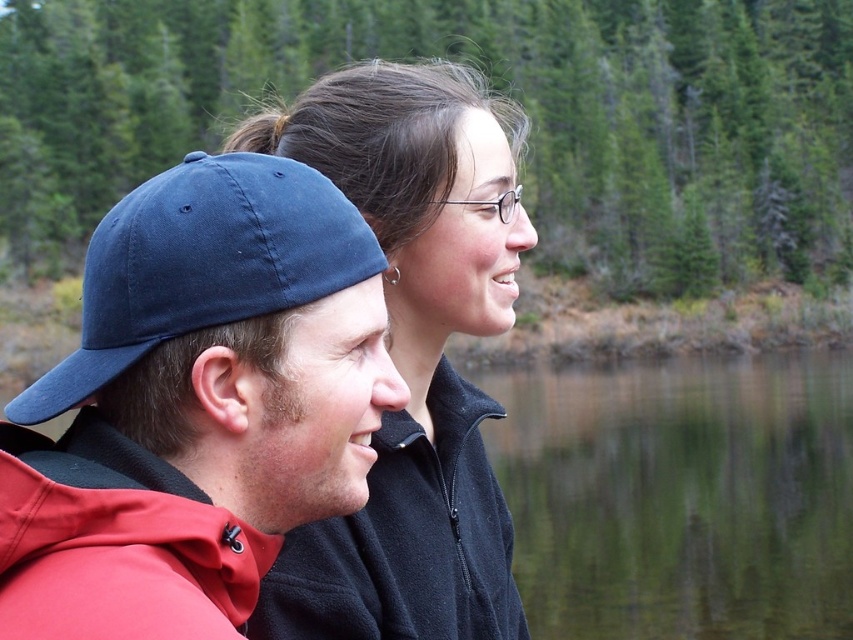
Does matte black jacket at center appear on the right side of navy blue fabric baseball cap at left?

Correct, you'll find matte black jacket at center to the right of navy blue fabric baseball cap at left.

Image resolution: width=853 pixels, height=640 pixels. What do you see at coordinates (413, 355) in the screenshot?
I see `matte black jacket at center` at bounding box center [413, 355].

Is point (395, 566) in front of point (53, 392)?

That is False.

This screenshot has width=853, height=640. In order to click on matte black jacket at center in this screenshot , I will do `click(413, 355)`.

Who is shorter, matte black jacket at center or green reflective water at center?

matte black jacket at center

Is matte black jacket at center wider than green reflective water at center?

Incorrect, matte black jacket at center's width does not surpass green reflective water at center's.

Between point (476, 420) and point (538, 397), which one is positioned in front?

Point (476, 420) is in front.

Locate an element on the screen. This screenshot has height=640, width=853. matte black jacket at center is located at coordinates (413, 355).

Can you confirm if green reflective water at center is taller than navy blue fabric baseball cap at left?

Yes, green reflective water at center is taller than navy blue fabric baseball cap at left.

Is green reflective water at center smaller than navy blue fabric baseball cap at left?

No.

From the picture: Measure the distance between point (709, 595) and camera.

The distance of point (709, 595) from camera is 36.37 meters.

Image resolution: width=853 pixels, height=640 pixels. I want to click on green reflective water at center, so click(x=680, y=497).